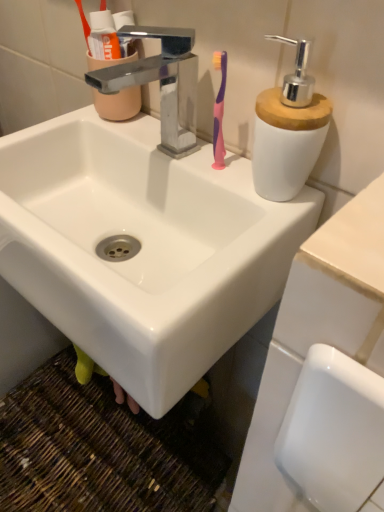
In order to face satin nickel faucet at center, should I rotate leftwards or rightwards?

You should rotate left by 6.284 degrees.

The height and width of the screenshot is (512, 384). In order to click on satin nickel faucet at center in this screenshot , I will do `click(161, 83)`.

The width and height of the screenshot is (384, 512). What do you see at coordinates (105, 42) in the screenshot? I see `translucent plastic cup at upper left` at bounding box center [105, 42].

Where is `white ceramic sink at center`? The image size is (384, 512). white ceramic sink at center is located at coordinates (142, 247).

Which is behind, translucent plastic cup at upper left or satin nickel faucet at center?

translucent plastic cup at upper left is further from the camera.

Is translucent plastic cup at upper left far away from satin nickel faucet at center?

That's not correct — translucent plastic cup at upper left is a little close to satin nickel faucet at center.

Can you confirm if translucent plastic cup at upper left is taller than satin nickel faucet at center?

Yes, translucent plastic cup at upper left is taller than satin nickel faucet at center.

Is translucent plastic cup at upper left smaller than satin nickel faucet at center?

Yes.

Which of these two, white ceramic sink at center or satin nickel faucet at center, stands shorter?

With less height is satin nickel faucet at center.

Is white ceramic sink at center in front of or behind satin nickel faucet at center in the image?

Visually, white ceramic sink at center is located in front of satin nickel faucet at center.

From the image's perspective, between white ceramic sink at center and satin nickel faucet at center, which one is located above?

From the image's view, satin nickel faucet at center is above.

Is white ceramic sink at center inside or outside of satin nickel faucet at center?

white ceramic sink at center is not inside satin nickel faucet at center, it's outside.

Looking at this image, is translucent plastic cup at upper left facing away from white ceramic sink at center?

No, white ceramic sink at center is not at the back of translucent plastic cup at upper left.

Can you confirm if translucent plastic cup at upper left is taller than white ceramic sink at center?

No, translucent plastic cup at upper left is not taller than white ceramic sink at center.

Considering the sizes of translucent plastic cup at upper left and white ceramic sink at center in the image, is translucent plastic cup at upper left bigger or smaller than white ceramic sink at center?

translucent plastic cup at upper left is smaller than white ceramic sink at center.

Consider the image. Is translucent plastic cup at upper left in front of or behind white ceramic sink at center in the image?

translucent plastic cup at upper left is behind white ceramic sink at center.

Based on their sizes in the image, would you say satin nickel faucet at center is bigger or smaller than white ceramic sink at center?

satin nickel faucet at center is smaller than white ceramic sink at center.

Does point (164, 95) come behind point (173, 233)?

No, it is not.

Between satin nickel faucet at center and white ceramic sink at center, which one appears on the right side from the viewer's perspective?

From the viewer's perspective, satin nickel faucet at center appears more on the right side.

Considering the sizes of objects satin nickel faucet at center and white ceramic sink at center in the image provided, who is taller, satin nickel faucet at center or white ceramic sink at center?

white ceramic sink at center is taller.

Does point (138, 229) come in front of point (97, 68)?

Yes.

How different are the orientations of white ceramic sink at center and translucent plastic cup at upper left in degrees?

The angle between the facing direction of white ceramic sink at center and the facing direction of translucent plastic cup at upper left is 0.000414 degrees.

Is white ceramic sink at center taller or shorter than translucent plastic cup at upper left?

Clearly, white ceramic sink at center is taller compared to translucent plastic cup at upper left.

Between white ceramic sink at center and translucent plastic cup at upper left, which one has smaller size?

translucent plastic cup at upper left.

Would you say satin nickel faucet at center is outside translucent plastic cup at upper left?

That's correct, satin nickel faucet at center is outside of translucent plastic cup at upper left.

Is satin nickel faucet at center not close to translucent plastic cup at upper left?

That's not correct — satin nickel faucet at center is a little close to translucent plastic cup at upper left.

Based on the photo, in the image, is satin nickel faucet at center positioned in front of or behind translucent plastic cup at upper left?

satin nickel faucet at center is in front of translucent plastic cup at upper left.

The width and height of the screenshot is (384, 512). What are the coordinates of `tap lying on the right of translucent plastic cup at upper left` in the screenshot? It's located at (161, 83).

Identify the location of tap below the translucent plastic cup at upper left (from the image's perspective). This screenshot has width=384, height=512. (161, 83).

You are a GUI agent. You are given a task and a screenshot of the screen. Output one action in this format:
    pyautogui.click(x=<x>, y=<y>)
    Task: Click on the sink on the left of satin nickel faucet at center
    This screenshot has height=512, width=384.
    Given the screenshot: What is the action you would take?
    pyautogui.click(x=142, y=247)

Considering their positions, is white ceramic sink at center positioned further to translucent plastic cup at upper left than satin nickel faucet at center?

white ceramic sink at center.

Considering their positions, is translucent plastic cup at upper left positioned further to white ceramic sink at center than satin nickel faucet at center?

translucent plastic cup at upper left.

Estimate the real-world distances between objects in this image. Which object is closer to white ceramic sink at center, satin nickel faucet at center or translucent plastic cup at upper left?

Based on the image, satin nickel faucet at center appears to be nearer to white ceramic sink at center.

Which object lies nearer to the anchor point satin nickel faucet at center, translucent plastic cup at upper left or white ceramic sink at center?

translucent plastic cup at upper left is closer to satin nickel faucet at center.

Estimate the real-world distances between objects in this image. Which object is further from translucent plastic cup at upper left, satin nickel faucet at center or white ceramic sink at center?

white ceramic sink at center is further to translucent plastic cup at upper left.

Looking at the image, which one is located further to satin nickel faucet at center, white ceramic sink at center or translucent plastic cup at upper left?

white ceramic sink at center lies further to satin nickel faucet at center than the other object.

Where is `tap that lies between translucent plastic cup at upper left and white ceramic sink at center from top to bottom`? This screenshot has height=512, width=384. tap that lies between translucent plastic cup at upper left and white ceramic sink at center from top to bottom is located at coordinates (161, 83).